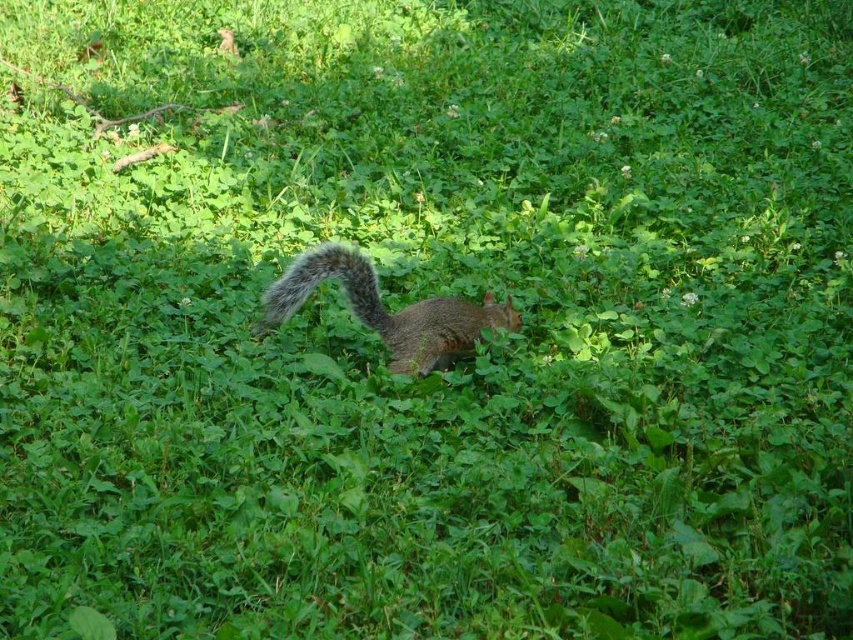
Who is lower down, gray-furred squirrel at center or fuzzy gray tail at center?

gray-furred squirrel at center is lower down.

Between gray-furred squirrel at center and fuzzy gray tail at center, which one appears on the right side from the viewer's perspective?

From the viewer's perspective, gray-furred squirrel at center appears more on the right side.

I want to click on gray-furred squirrel at center, so click(386, 310).

In order to click on gray-furred squirrel at center in this screenshot , I will do `click(386, 310)`.